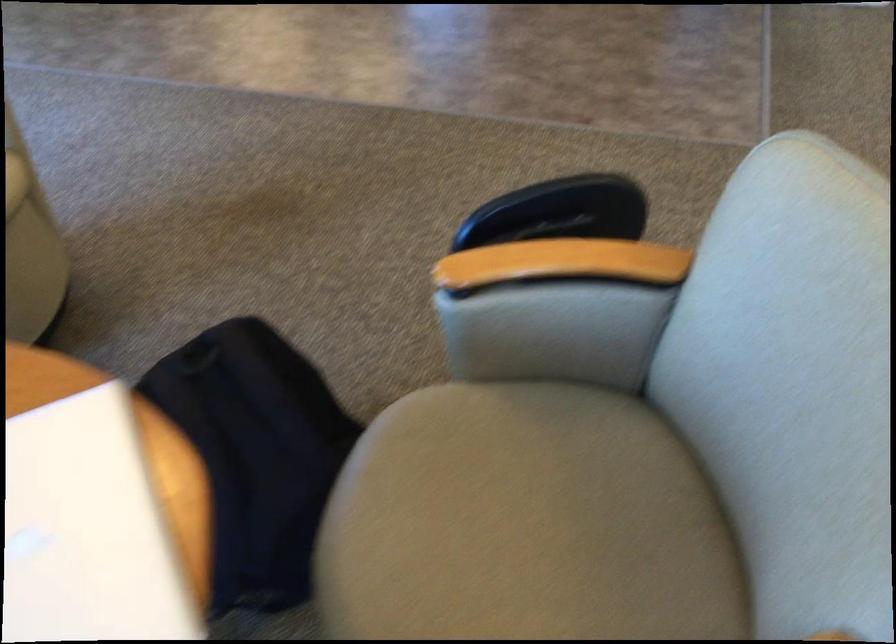
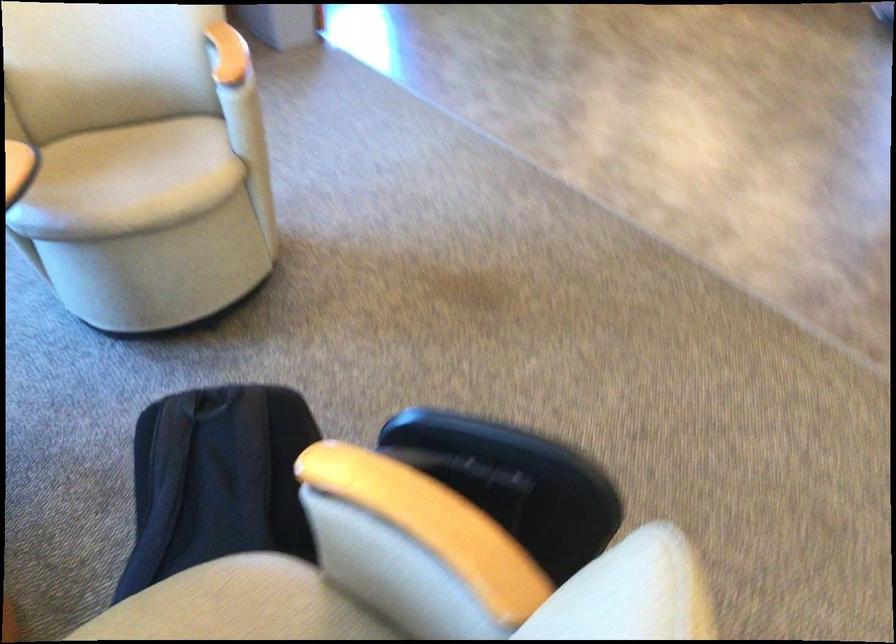
Locate, in the second image, the point that corresponds to [574,256] in the first image.

(431, 525)